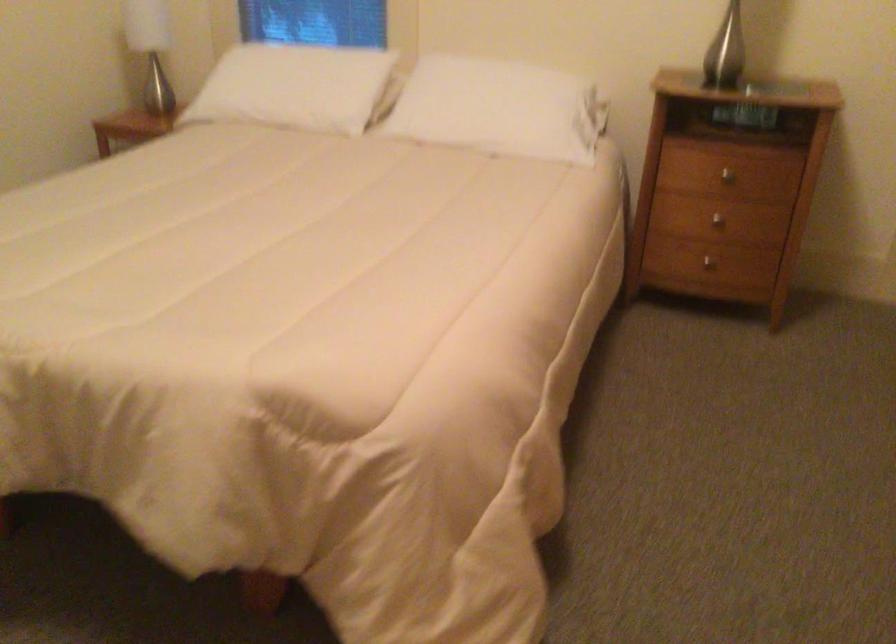
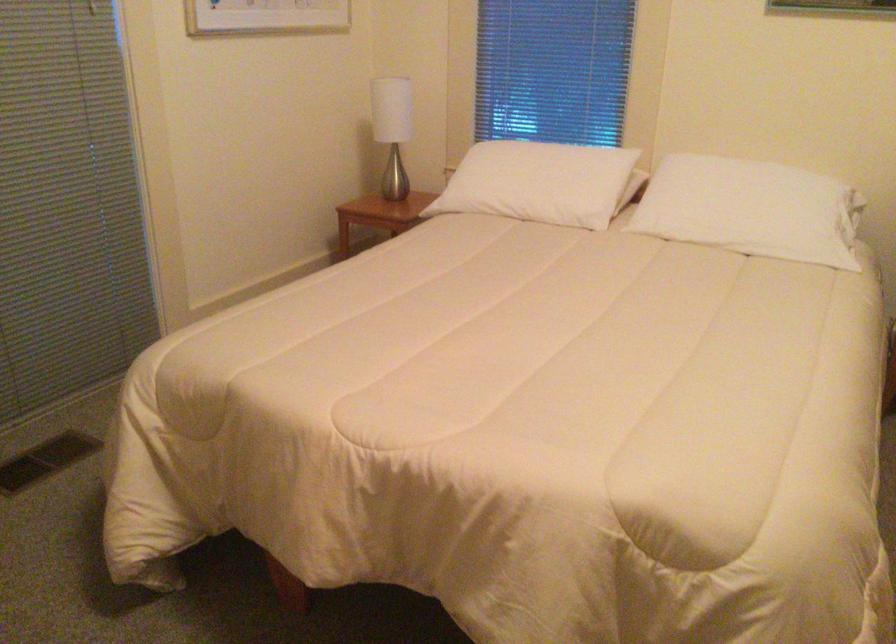
The point at (487,114) is marked in the first image. Where is the corresponding point in the second image?

(752, 210)